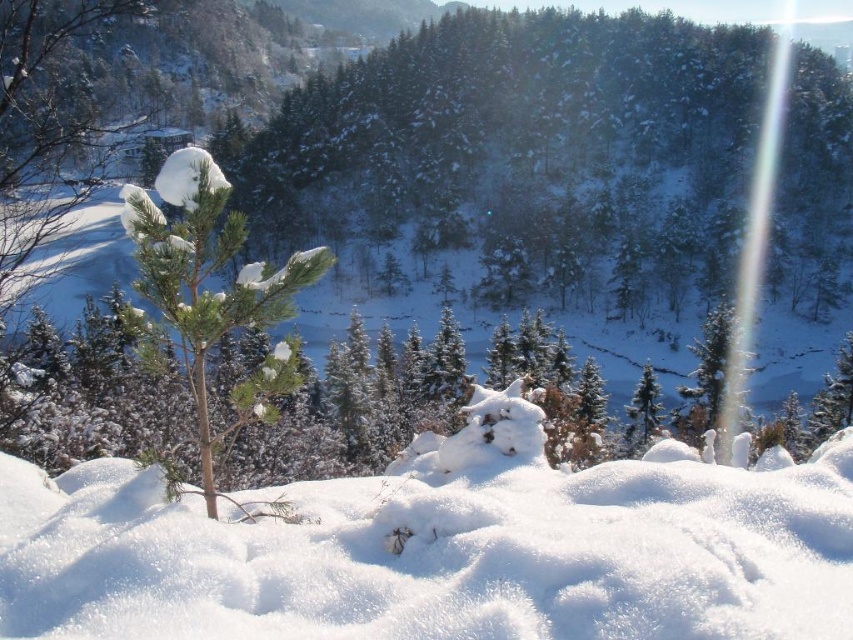
You are standing in the winter landscape and want to walk from the point at coordinates point [706,339] to the point at coordinates point [634,424]. Since both points are marked on your map, can you determine which direction you should walk to reach your destination?

Point [706,339] is in front of point [634,424], so to reach point [634,424] from point [706,339], you should walk backward or away from your current position.

You are standing at the point marked as point (439,548) in the winter landscape. Looking around, you see a small snow covered pine tree in the foreground and a cluster of evergreen trees in the mid ground. What is directly under your feet?

The point (439,548) is on white fluffy snow at center, so the area directly under your feet is white fluffy snow at center.